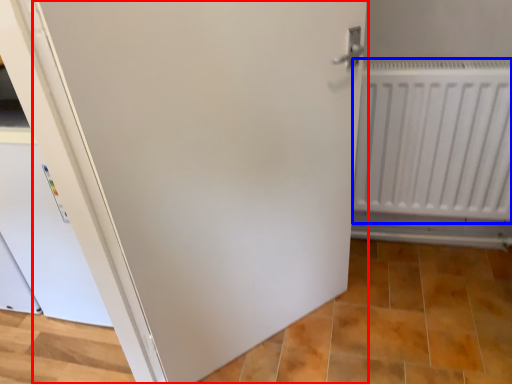
Question: Which point is further to the camera, door (highlighted by a red box) or radiator (highlighted by a blue box)?

Choices:
 (A) door
 (B) radiator

Answer: (B)